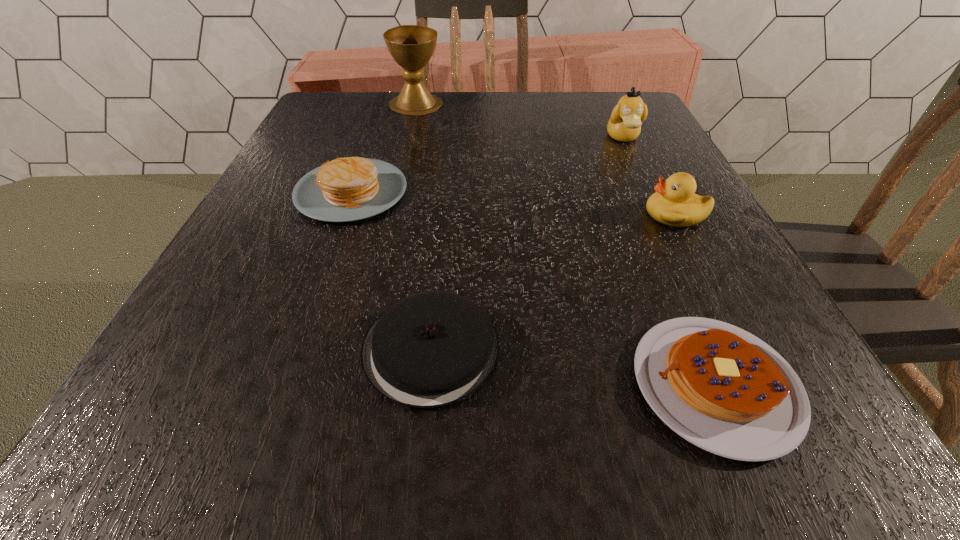
I want to click on object that is at the far right corner, so click(626, 119).

The height and width of the screenshot is (540, 960). I want to click on object that is at the near right corner, so click(721, 388).

Find the location of a particular element. vacant space at the far edge of the desktop is located at coordinates (452, 112).

You are a GUI agent. You are given a task and a screenshot of the screen. Output one action in this format:
    pyautogui.click(x=<x>, y=<y>)
    Task: Click on the free space at the near edge
    The image size is (960, 540).
    Given the screenshot: What is the action you would take?
    pyautogui.click(x=315, y=401)

Where is `vacant space at the left edge of the desktop`? vacant space at the left edge of the desktop is located at coordinates [273, 271].

In the image, there is a desktop. In order to click on vacant space at the right edge in this screenshot , I will do `click(685, 230)`.

Find the location of a particular element. The image size is (960, 540). vacant space at the far left corner is located at coordinates (372, 126).

Where is `empty space that is in between the shorter duckling and the farthest pancake`? Image resolution: width=960 pixels, height=540 pixels. empty space that is in between the shorter duckling and the farthest pancake is located at coordinates (514, 203).

This screenshot has height=540, width=960. What are the coordinates of `vacant region between the farthest pancake and the rightmost pancake` in the screenshot? It's located at (533, 288).

At what (x,y) coordinates should I click in order to perform the action: click on free space between the third tallest object and the shortest pancake. Please return your answer as a coordinate pair (x, y). The image size is (960, 540). Looking at the image, I should click on (695, 299).